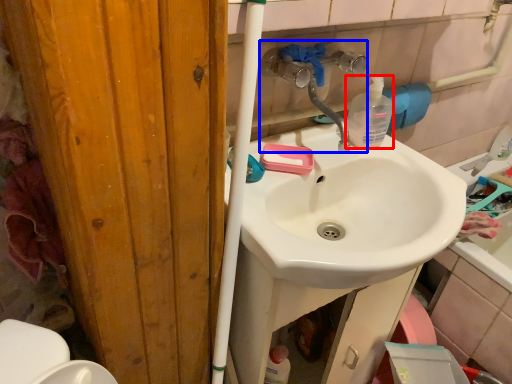
Question: Which of the following is the farthest to the observer, bottle (highlighted by a red box) or plumbing fixture (highlighted by a blue box)?

Choices:
 (A) bottle
 (B) plumbing fixture

Answer: (A)